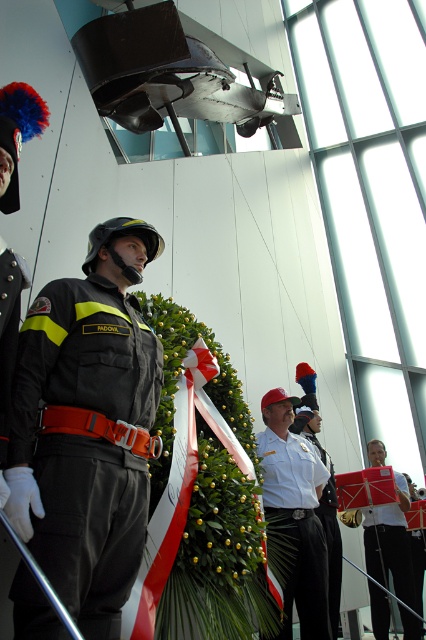
Question: In this image, where is dark gray matte uniform at left located relative to white cotton shirt at center?

Choices:
 (A) below
 (B) above

Answer: (B)

Question: Which point is closer to the camera?

Choices:
 (A) (127, 296)
 (B) (268, 499)
 (C) (314, 420)
 (D) (408, 579)

Answer: (A)

Question: Considering the relative positions of dark gray matte uniform at left and white cotton shirt at center in the image provided, where is dark gray matte uniform at left located with respect to white cotton shirt at center?

Choices:
 (A) below
 (B) above

Answer: (B)

Question: From the image, what is the correct spatial relationship of dark gray matte uniform at left in relation to white glossy uniform at center?

Choices:
 (A) below
 (B) above

Answer: (B)

Question: Which of the following is the closest to the observer?

Choices:
 (A) white glossy uniform at center
 (B) matte black uniform at lower right
 (C) dark gray matte uniform at left

Answer: (C)

Question: Which of the following is the farthest from the observer?

Choices:
 (A) (60, 320)
 (B) (322, 508)

Answer: (B)